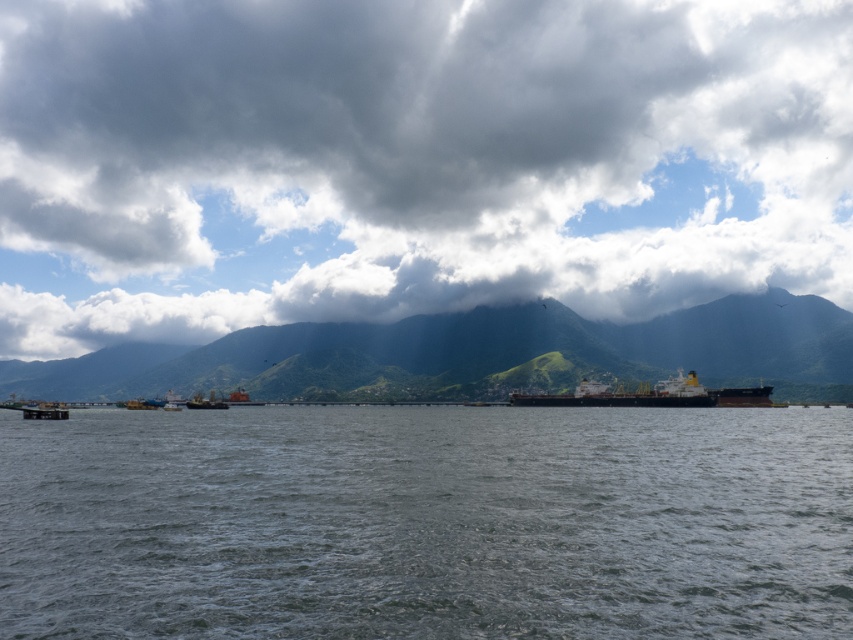
Between point (735, 394) and point (223, 406), which one is positioned behind?

Positioned behind is point (223, 406).

Can you confirm if black matte cargo ship at center is wider than metallic gray boat at center?

No.

Which is behind, point (682, 372) or point (213, 394)?

Point (213, 394)

Where is `black matte cargo ship at center`? The image size is (853, 640). black matte cargo ship at center is located at coordinates (651, 394).

Who is shorter, cloudy sky at upper center or green grassy mountain at center?

green grassy mountain at center is shorter.

Is cloudy sky at upper center to the left of green grassy mountain at center from the viewer's perspective?

Answer: Incorrect, cloudy sky at upper center is not on the left side of green grassy mountain at center.

What do you see at coordinates (410, 161) in the screenshot? Image resolution: width=853 pixels, height=640 pixels. I see `cloudy sky at upper center` at bounding box center [410, 161].

This screenshot has height=640, width=853. I want to click on cloudy sky at upper center, so click(410, 161).

Is metallic gray boat at lower left above metallic gray boat at center?

Correct, metallic gray boat at lower left is located above metallic gray boat at center.

Can you confirm if metallic gray boat at lower left is taller than metallic gray boat at center?

Yes, metallic gray boat at lower left is taller than metallic gray boat at center.

Is point (26, 410) positioned in front of point (195, 394)?

Yes.

Identify the location of metallic gray boat at lower left. (45, 410).